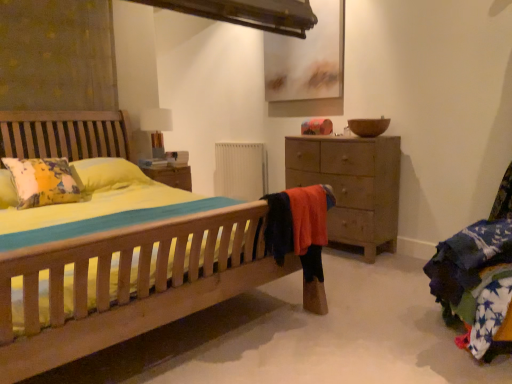
Question: From a real-world perspective, is white fabric table lamp at upper center under wooden chest of drawers at right?

Choices:
 (A) yes
 (B) no

Answer: (B)

Question: Is wooden chest of drawers at right surrounded by white fabric table lamp at upper center?

Choices:
 (A) yes
 (B) no

Answer: (B)

Question: Is white fabric table lamp at upper center facing towards wooden chest of drawers at right?

Choices:
 (A) no
 (B) yes

Answer: (A)

Question: Is white fabric table lamp at upper center outside wooden chest of drawers at right?

Choices:
 (A) yes
 (B) no

Answer: (A)

Question: Does white fabric table lamp at upper center touch wooden chest of drawers at right?

Choices:
 (A) no
 (B) yes

Answer: (A)

Question: Is white fabric table lamp at upper center at the right side of wooden chest of drawers at right?

Choices:
 (A) yes
 (B) no

Answer: (B)

Question: Considering the relative sizes of white matte radiator at center and white fabric table lamp at upper center in the image provided, is white matte radiator at center wider than white fabric table lamp at upper center?

Choices:
 (A) no
 (B) yes

Answer: (A)

Question: Considering the relative positions of white matte radiator at center and white fabric table lamp at upper center in the image provided, is white matte radiator at center behind white fabric table lamp at upper center?

Choices:
 (A) yes
 (B) no

Answer: (A)

Question: Can you confirm if white matte radiator at center is shorter than white fabric table lamp at upper center?

Choices:
 (A) no
 (B) yes

Answer: (A)

Question: Is white matte radiator at center not close to white fabric table lamp at upper center?

Choices:
 (A) yes
 (B) no

Answer: (B)

Question: Is white matte radiator at center to the right of white fabric table lamp at upper center from the viewer's perspective?

Choices:
 (A) no
 (B) yes

Answer: (B)

Question: Considering the relative sizes of white matte radiator at center and white fabric table lamp at upper center in the image provided, is white matte radiator at center bigger than white fabric table lamp at upper center?

Choices:
 (A) yes
 (B) no

Answer: (A)

Question: Is white fabric table lamp at upper center outside white matte radiator at center?

Choices:
 (A) yes
 (B) no

Answer: (A)